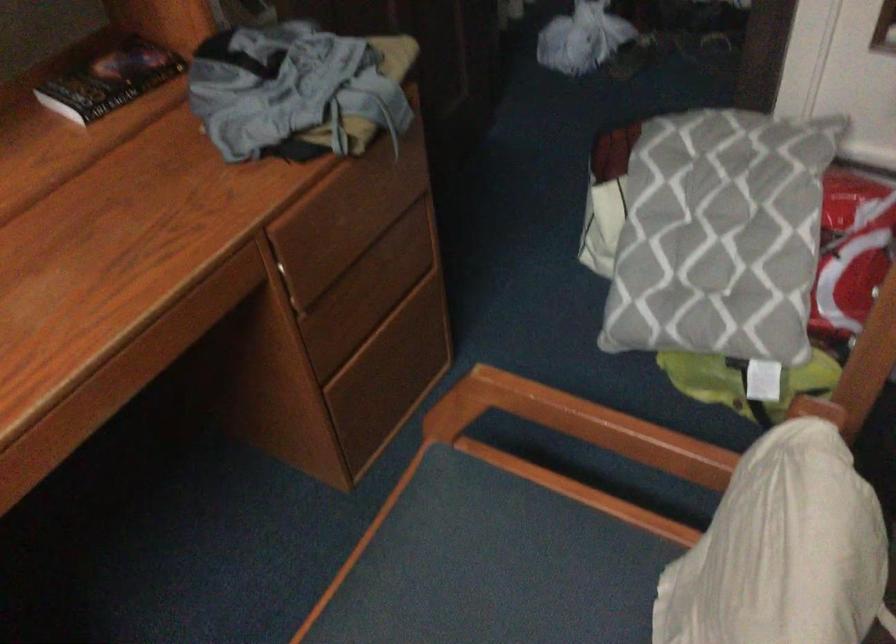
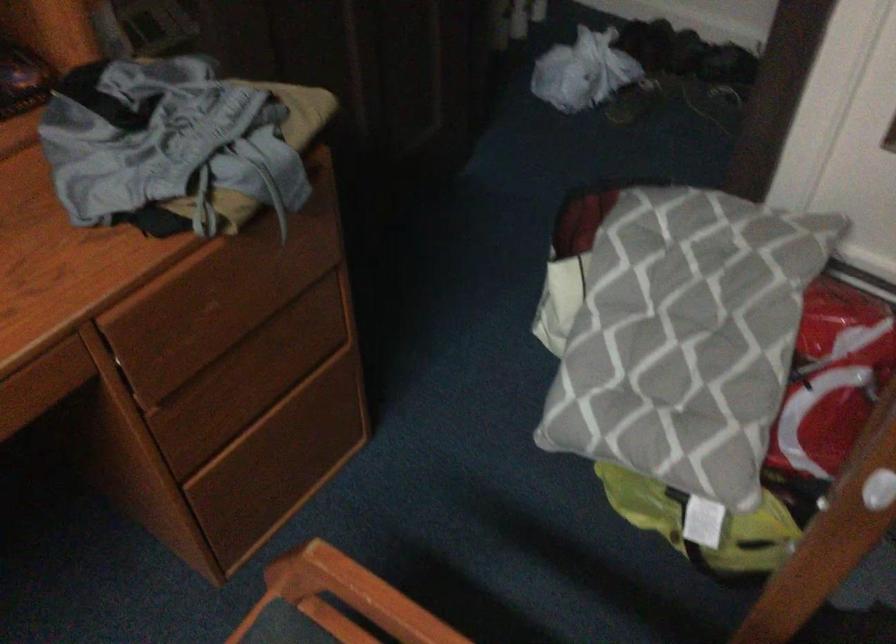
Question: The first image is from the beginning of the video and the second image is from the end. How did the camera likely rotate when shooting the video?

Choices:
 (A) Left
 (B) Right
 (C) Up
 (D) Down

Answer: (D)